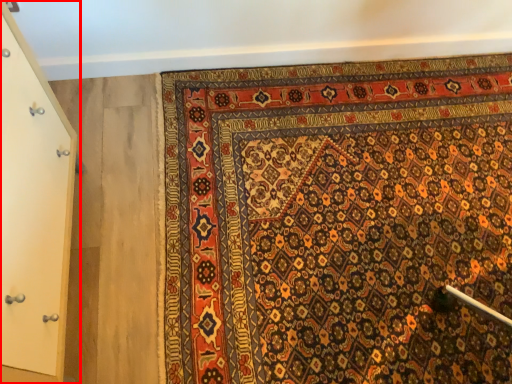
Question: From the image's perspective, considering the relative positions of door (annotated by the red box) and mat in the image provided, where is door (annotated by the red box) located with respect to the staircase?

Choices:
 (A) above
 (B) below

Answer: (B)